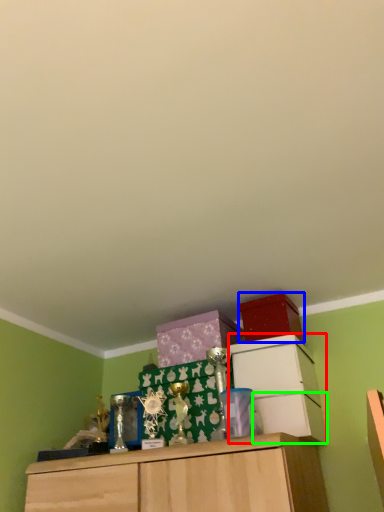
Question: Considering the real-world distances, which object is farthest from cabinetry (highlighted by a red box)? storage box (highlighted by a blue box) or drawer (highlighted by a green box)?

Choices:
 (A) storage box
 (B) drawer

Answer: (A)